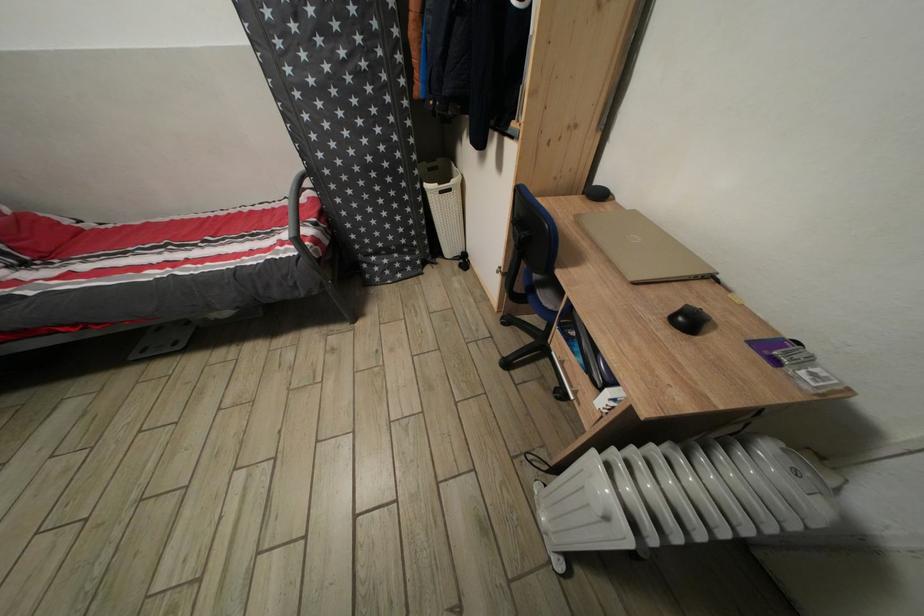
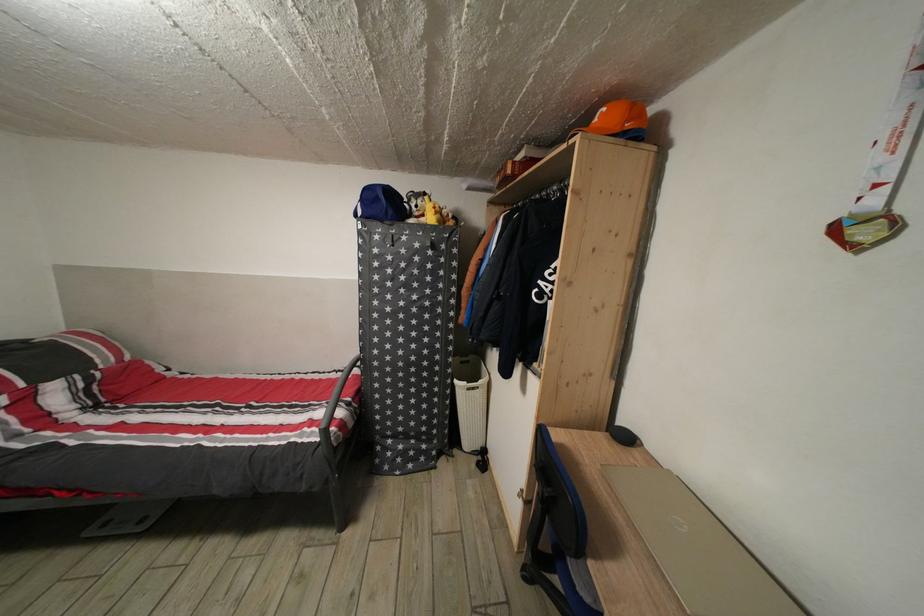
Question: How did the camera likely rotate?

Choices:
 (A) Left
 (B) Right
 (C) Up
 (D) Down

Answer: (C)